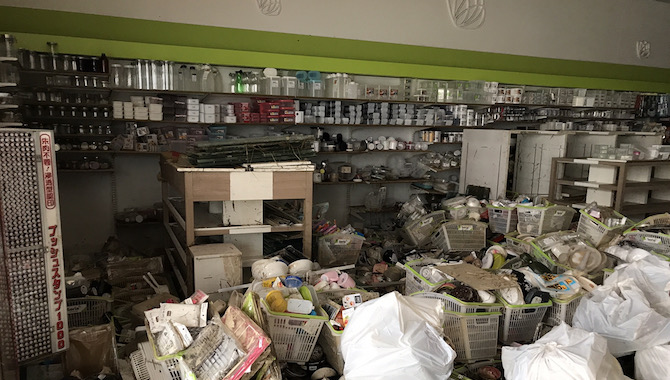
Identify the location of trash bag. (553, 362), (604, 319), (655, 267), (658, 356), (409, 339).